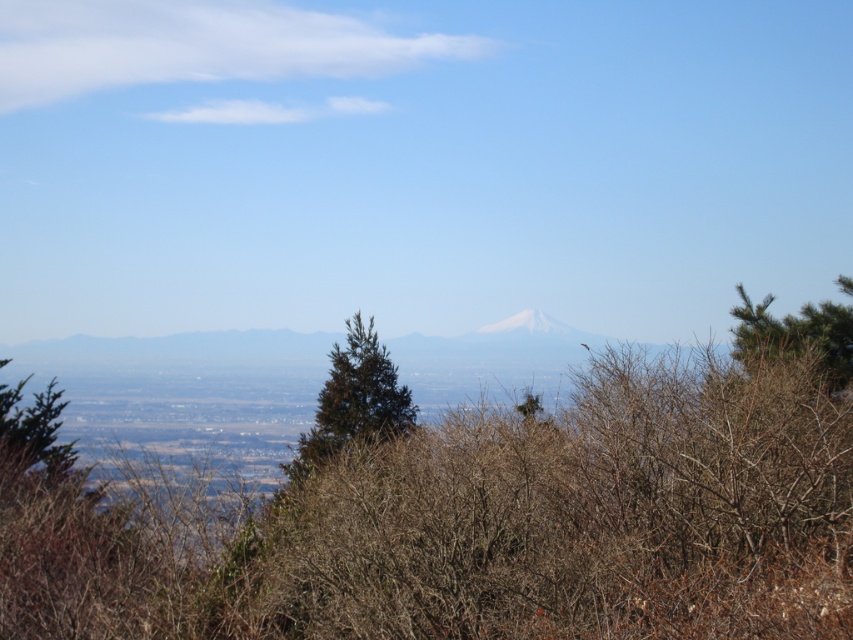
Does green textured pine tree at center appear under white snow-capped peak at center?

Indeed, green textured pine tree at center is positioned under white snow-capped peak at center.

Is green textured pine tree at center shorter than white snow-capped peak at center?

No.

Locate an element on the screen. The image size is (853, 640). green textured pine tree at center is located at coordinates (354, 401).

Which is more to the right, green textured pine tree at center or brown textured tree at left?

From the viewer's perspective, green textured pine tree at center appears more on the right side.

Which is in front, point (309, 440) or point (45, 460)?

Point (45, 460)

Locate an element on the screen. The height and width of the screenshot is (640, 853). green textured pine tree at center is located at coordinates (354, 401).

You are a GUI agent. You are given a task and a screenshot of the screen. Output one action in this format:
    pyautogui.click(x=<x>, y=<y>)
    Task: Click on the green textured pine tree at center
    This screenshot has width=853, height=640.
    Given the screenshot: What is the action you would take?
    pyautogui.click(x=354, y=401)

Which is above, brown textured tree at left or white snow-capped peak at center?

white snow-capped peak at center is above.

Between brown textured tree at left and white snow-capped peak at center, which one appears on the right side from the viewer's perspective?

A: From the viewer's perspective, white snow-capped peak at center appears more on the right side.

The width and height of the screenshot is (853, 640). What do you see at coordinates (32, 433) in the screenshot? I see `brown textured tree at left` at bounding box center [32, 433].

Where is `brown textured tree at left`? brown textured tree at left is located at coordinates (32, 433).